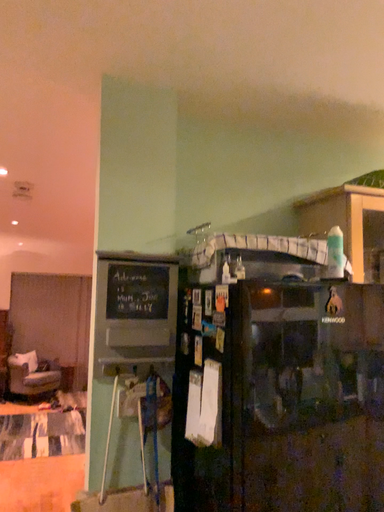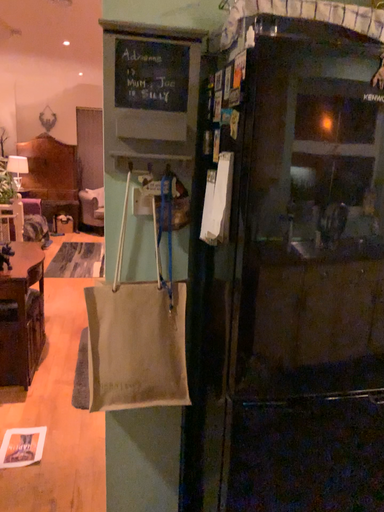
Question: Which way did the camera rotate in the video?

Choices:
 (A) rotated downward
 (B) rotated upward

Answer: (A)